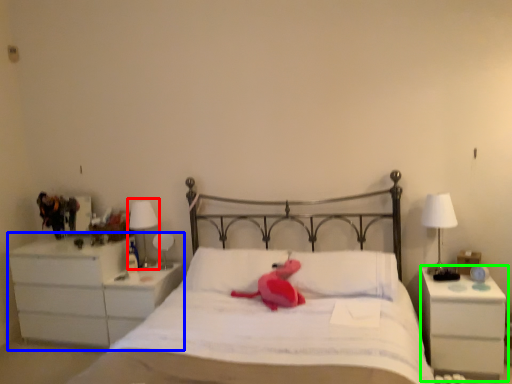
Question: Considering the real-world distances, which object is closest to bedside lamp (highlighted by a red box)? chest of drawers (highlighted by a blue box) or nightstand (highlighted by a green box).

Choices:
 (A) chest of drawers
 (B) nightstand

Answer: (A)